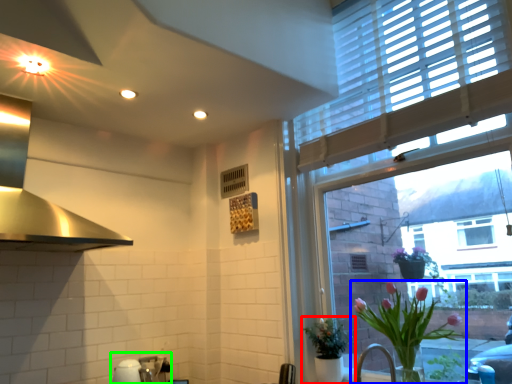
Question: Estimate the real-world distances between objects in this image. Which object is closer to houseplant (highlighted by a red box), houseplant (highlighted by a blue box) or sink (highlighted by a green box)?

Choices:
 (A) houseplant
 (B) sink

Answer: (A)